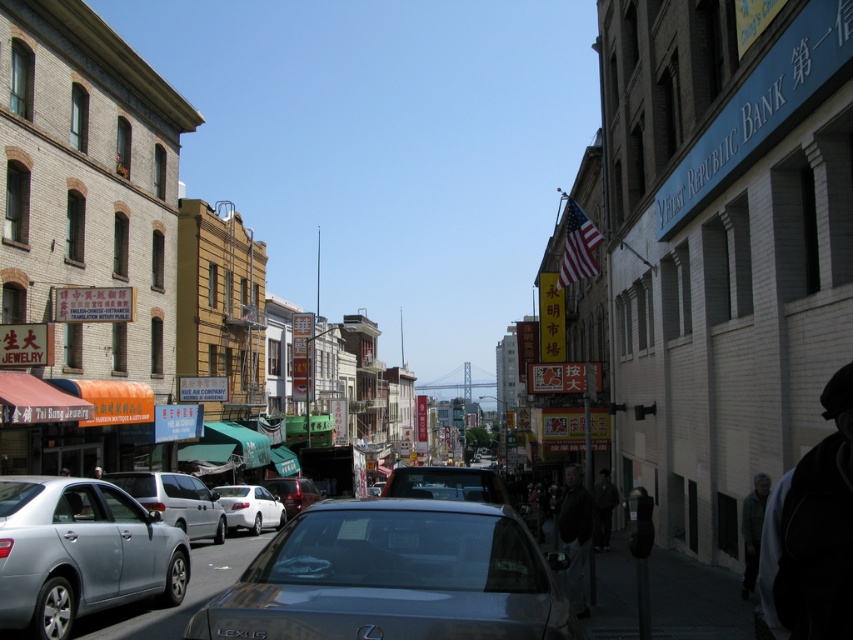
Based on the photo, who is positioned more to the right, silver metallic van at center or gray wool coat at lower right?

Positioned to the right is gray wool coat at lower right.

In the scene shown: Which of these two, silver metallic van at center or gray wool coat at lower right, stands taller?

Standing taller between the two is silver metallic van at center.

Which is in front, point (126, 492) or point (759, 493)?

Positioned in front is point (759, 493).

In order to click on silver metallic van at center in this screenshot , I will do `click(177, 500)`.

Which of these two, dark gray jacket at lower right or white matte sedan at center, stands taller?

Standing taller between the two is dark gray jacket at lower right.

Is point (564, 531) more distant than point (270, 509)?

That is False.

This screenshot has height=640, width=853. Identify the location of dark gray jacket at lower right. [573, 536].

Is dark gray jacket at lower right taller than gray wool coat at lower right?

Yes, dark gray jacket at lower right is taller than gray wool coat at lower right.

Identify the location of dark gray jacket at lower right. This screenshot has width=853, height=640. (573, 536).